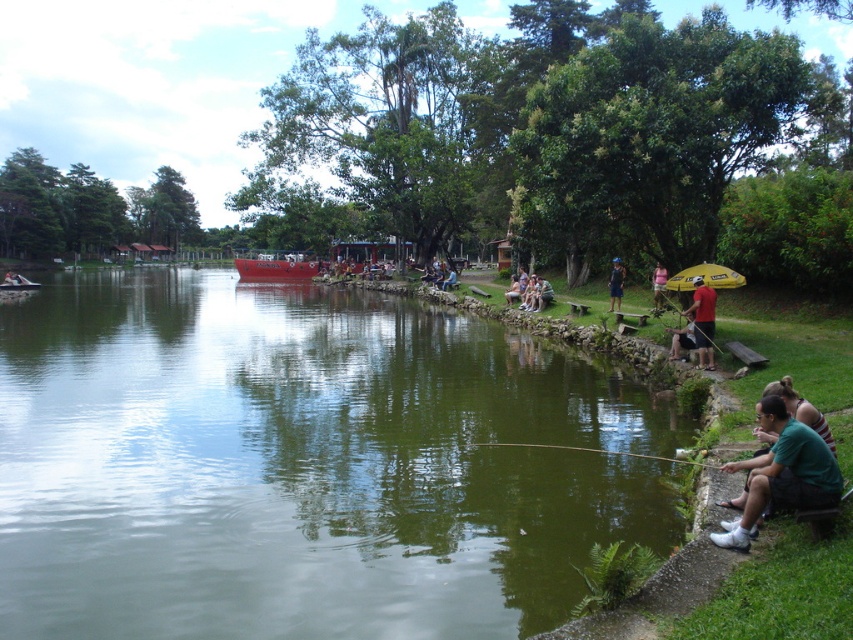
You are planning to take a photo of the green smooth water at center and the red matte shirt at right. Which object should you focus on first if you want to capture both in a single frame without moving the camera?

The green smooth water at center is larger in size than the red matte shirt at right, so you should focus on the green smooth water at center first to ensure it fills the frame appropriately before adjusting for the smaller red matte shirt at right.